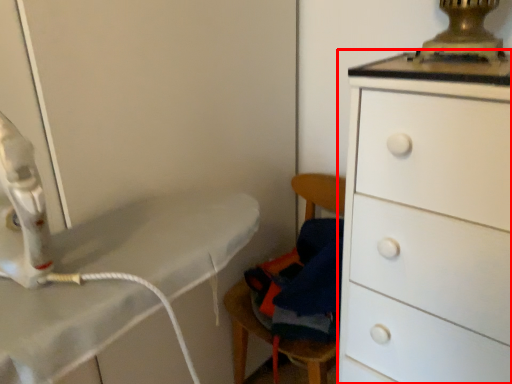
Question: In this image, where is chest of drawers (annotated by the red box) located relative to swivel chair?

Choices:
 (A) right
 (B) left

Answer: (A)